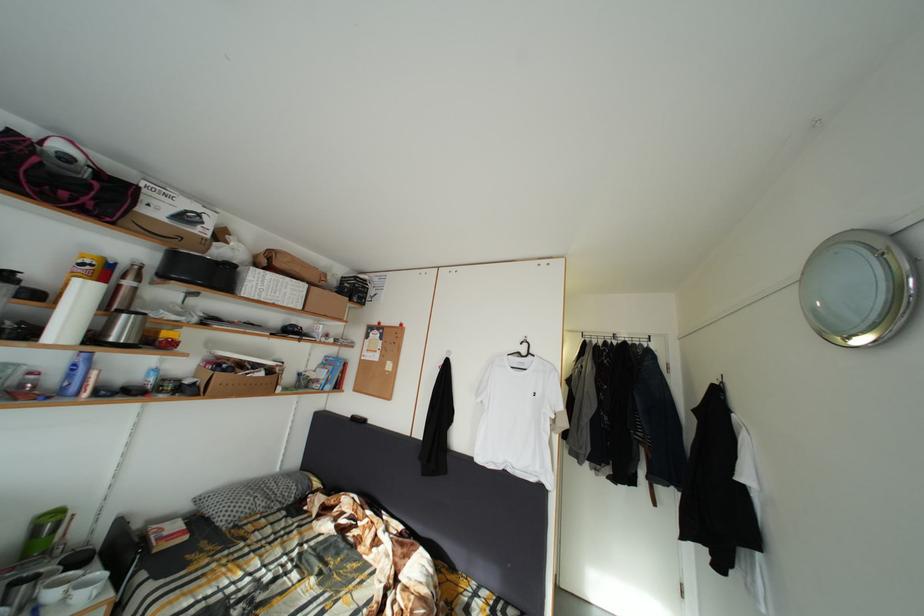
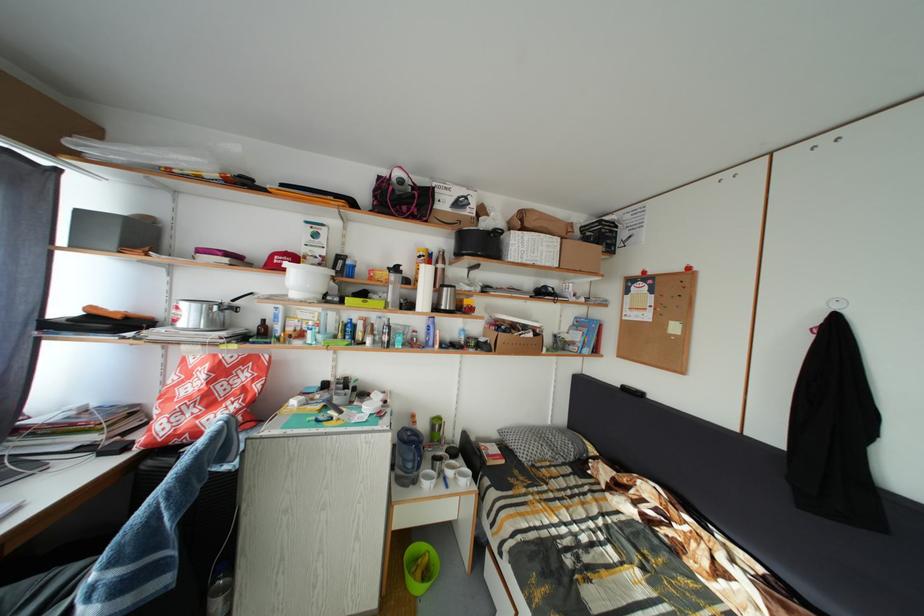
Find the pixel in the second image that matches [44,584] in the first image.

(450, 464)